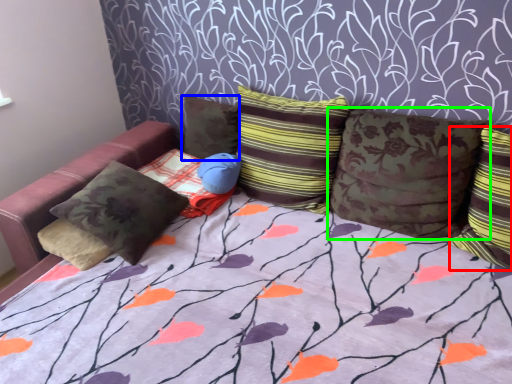
Question: Which object is positioned closest to pillow (highlighted by a red box)? Select from pillow (highlighted by a blue box) and pillow (highlighted by a green box).

Choices:
 (A) pillow
 (B) pillow

Answer: (B)